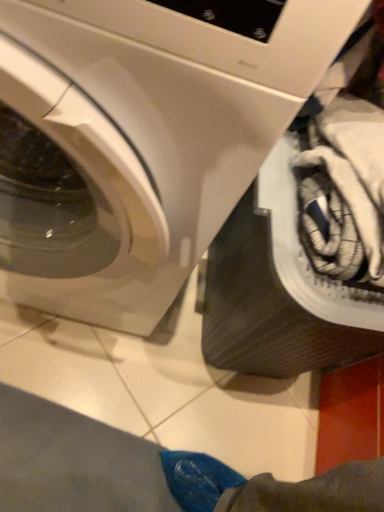
Question: Is black rubber tire at lower right wider than white glossy washing machine at upper left?

Choices:
 (A) no
 (B) yes

Answer: (A)

Question: Can white glossy washing machine at upper left be found inside black rubber tire at lower right?

Choices:
 (A) yes
 (B) no

Answer: (B)

Question: From a real-world perspective, is black rubber tire at lower right physically above white glossy washing machine at upper left?

Choices:
 (A) no
 (B) yes

Answer: (A)

Question: Is black rubber tire at lower right with white glossy washing machine at upper left?

Choices:
 (A) no
 (B) yes

Answer: (A)

Question: Is there a large distance between black rubber tire at lower right and white glossy washing machine at upper left?

Choices:
 (A) no
 (B) yes

Answer: (A)

Question: Does black rubber tire at lower right appear on the left side of white glossy washing machine at upper left?

Choices:
 (A) no
 (B) yes

Answer: (A)

Question: Is white glossy washing machine at upper left oriented towards black rubber tire at lower right?

Choices:
 (A) no
 (B) yes

Answer: (A)

Question: From a real-world perspective, is white glossy washing machine at upper left under black rubber tire at lower right?

Choices:
 (A) yes
 (B) no

Answer: (B)

Question: Is white glossy washing machine at upper left completely or partially outside of black rubber tire at lower right?

Choices:
 (A) no
 (B) yes

Answer: (B)

Question: Considering the relative positions of white glossy washing machine at upper left and black rubber tire at lower right in the image provided, is white glossy washing machine at upper left behind black rubber tire at lower right?

Choices:
 (A) yes
 (B) no

Answer: (B)

Question: Can you confirm if white glossy washing machine at upper left is wider than black rubber tire at lower right?

Choices:
 (A) no
 (B) yes

Answer: (B)

Question: Considering the relative sizes of white glossy washing machine at upper left and black rubber tire at lower right in the image provided, is white glossy washing machine at upper left thinner than black rubber tire at lower right?

Choices:
 (A) yes
 (B) no

Answer: (B)

Question: Is black rubber tire at lower right bigger or smaller than white glossy washing machine at upper left?

Choices:
 (A) small
 (B) big

Answer: (A)